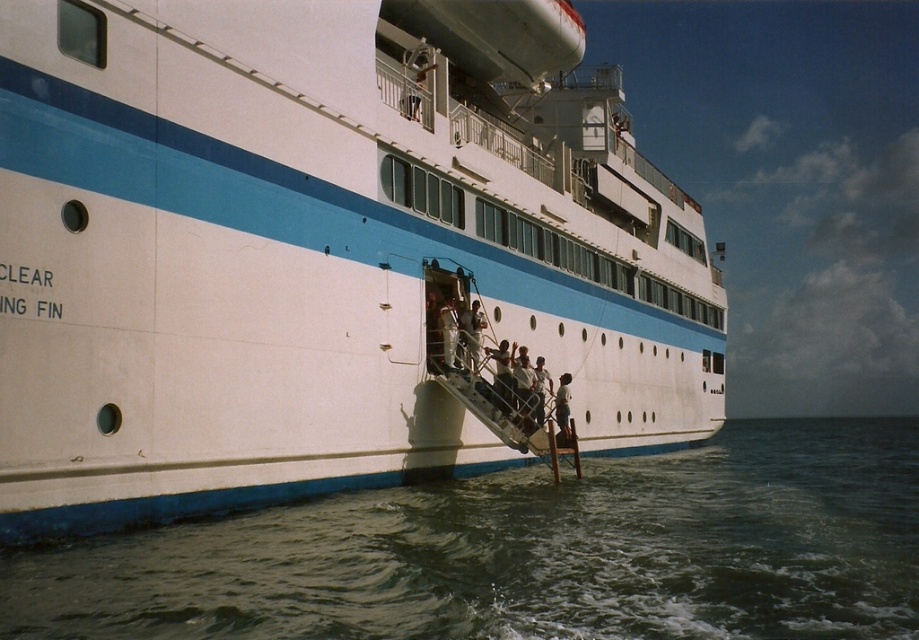
Does greenish water at lower left have a lesser height compared to smooth white shirt at lower center?

No.

Is greenish water at lower left bigger than smooth white shirt at lower center?

Yes, greenish water at lower left is bigger than smooth white shirt at lower center.

Where is `greenish water at lower left`? The image size is (919, 640). greenish water at lower left is located at coordinates pos(528,554).

Can you confirm if greenish water at lower left is wider than light blue fabric shirt at lower center?

Indeed, greenish water at lower left has a greater width compared to light blue fabric shirt at lower center.

Between point (274, 563) and point (566, 392), which one is positioned in front?

Point (274, 563) is in front.

Find the location of a particular element. Image resolution: width=919 pixels, height=640 pixels. greenish water at lower left is located at coordinates (528, 554).

How much distance is there between white glossy ship at center and smooth white shirt at lower center?

A distance of 17.07 meters exists between white glossy ship at center and smooth white shirt at lower center.

Can you confirm if white glossy ship at center is wider than smooth white shirt at lower center?

Yes.

Which is behind, point (187, 428) or point (455, 326)?

Point (455, 326)

Image resolution: width=919 pixels, height=640 pixels. Find the location of `white glossy ship at center`. white glossy ship at center is located at coordinates (323, 252).